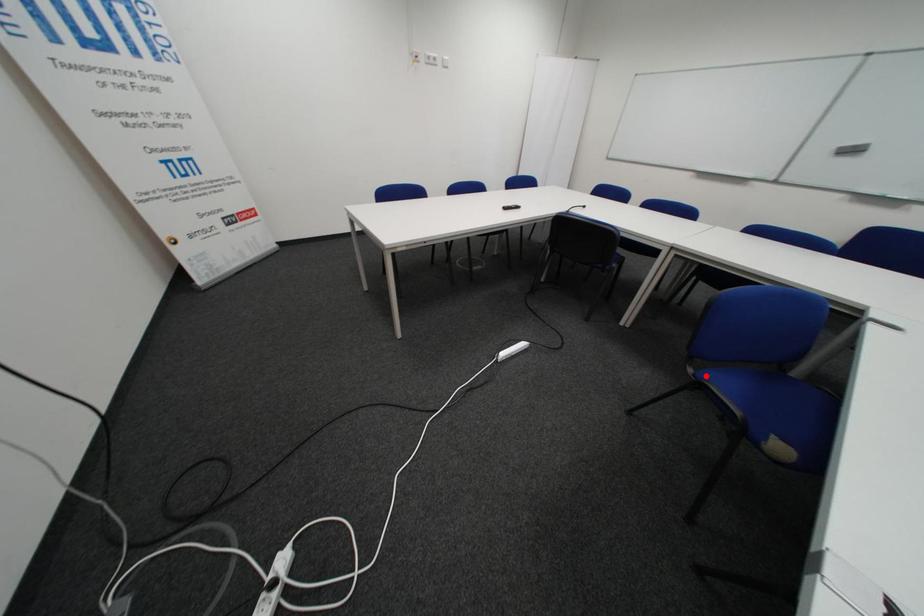
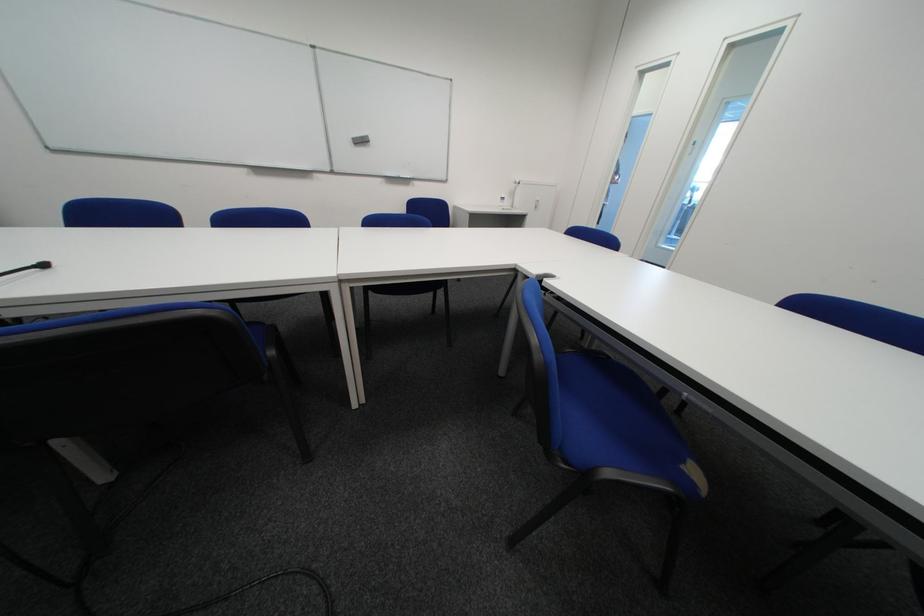
Locate, in the second image, the point that corresponds to the highlighted location in the first image.

(578, 464)